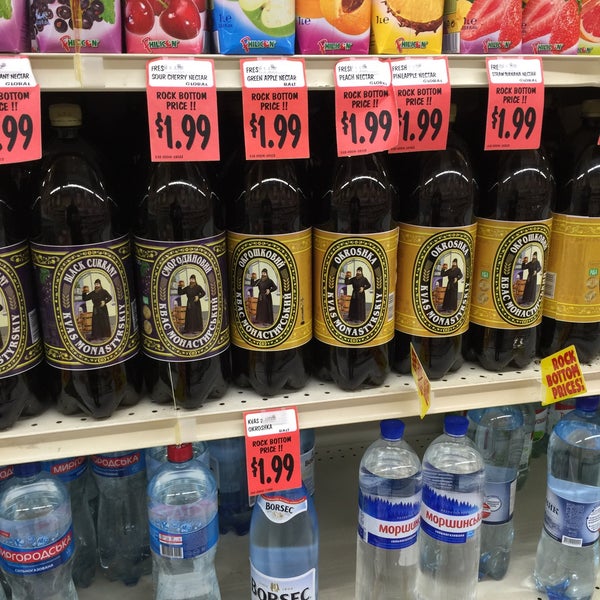
Find the location of a particular element. bottle is located at coordinates (381, 548).